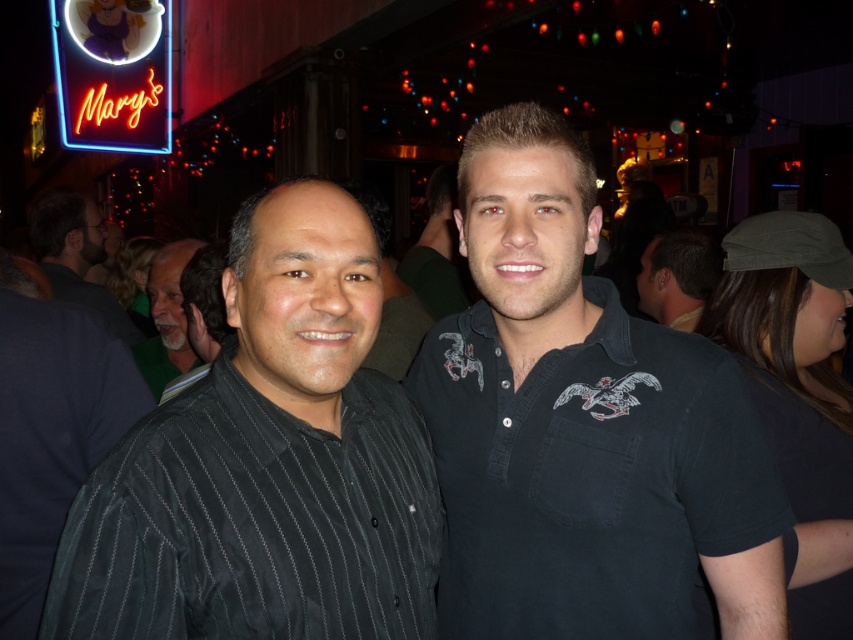
You are a photographer standing at the entrance of Marys, and you want to take a photo of the black pinstriped shirt at center and the neon sign at upper left. The minimum distance required between the subjects for your camera to focus properly is 30 feet. Will you be able to capture both subjects in focus?

The black pinstriped shirt at center and neon sign at upper left are 28.09 feet apart, which is less than the required 30 feet for proper focus. Therefore, you may not be able to capture both subjects in focus.

You are at Marys and want to order a drink. The bartender is wearing the black pinstriped shirt at center. The neon sign at upper left is where you should look to confirm the establishment name. Which object is closer to the entrance? Please explain your reasoning based on their positions.

The black pinstriped shirt at center is to the right of the neon sign at upper left. Since the entrance is typically located near the front where the neon sign is placed, the neon sign at upper left is likely closer to the entrance than the bartender wearing the black pinstriped shirt at center.